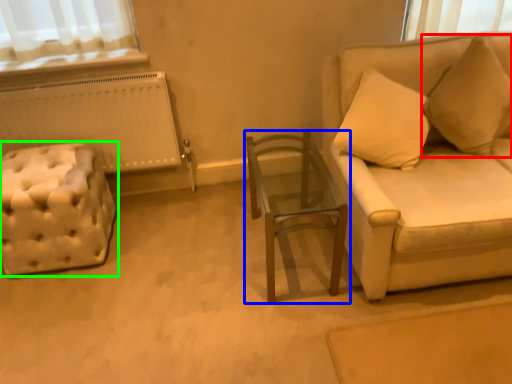
Question: Based on their relative distances, which object is nearer to pillow (highlighted by a red box)? Choose from table (highlighted by a blue box) and furniture (highlighted by a green box).

Choices:
 (A) table
 (B) furniture

Answer: (A)